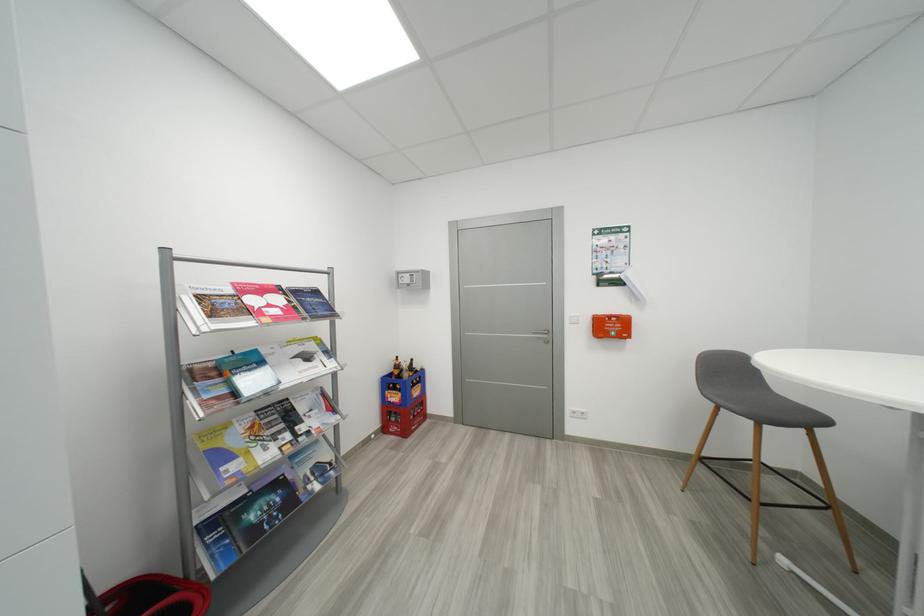
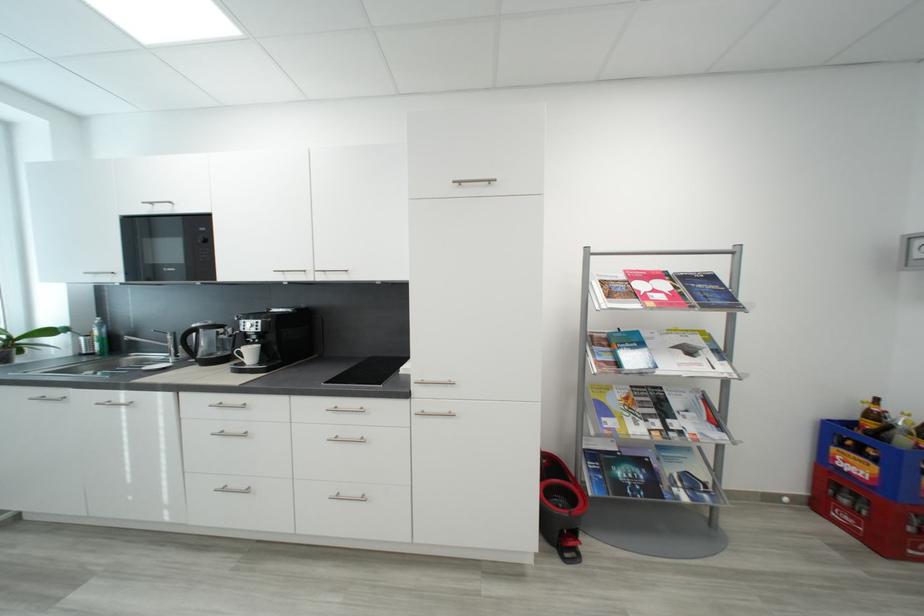
Where in the second image is the point corresponding to the point at 314,359 from the first image?

(697, 353)